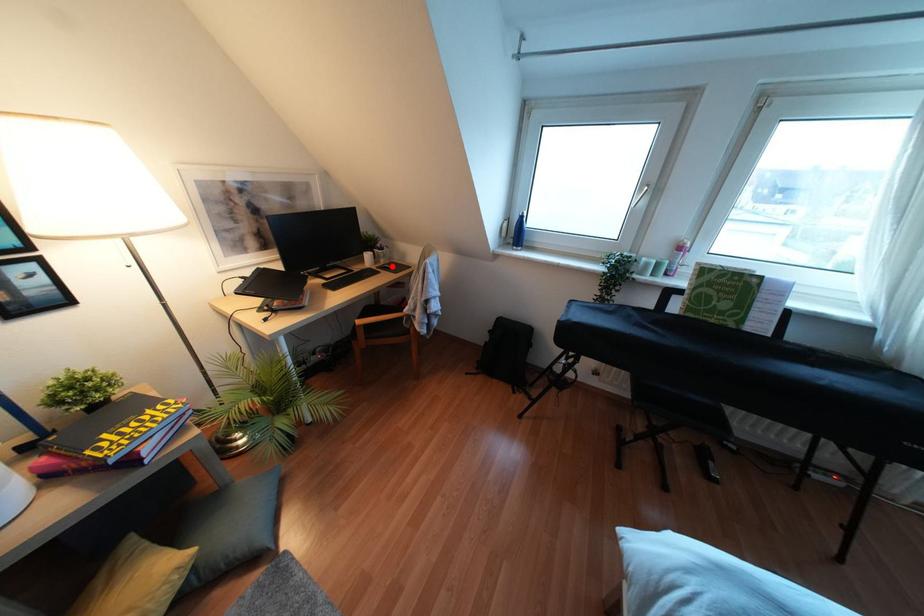
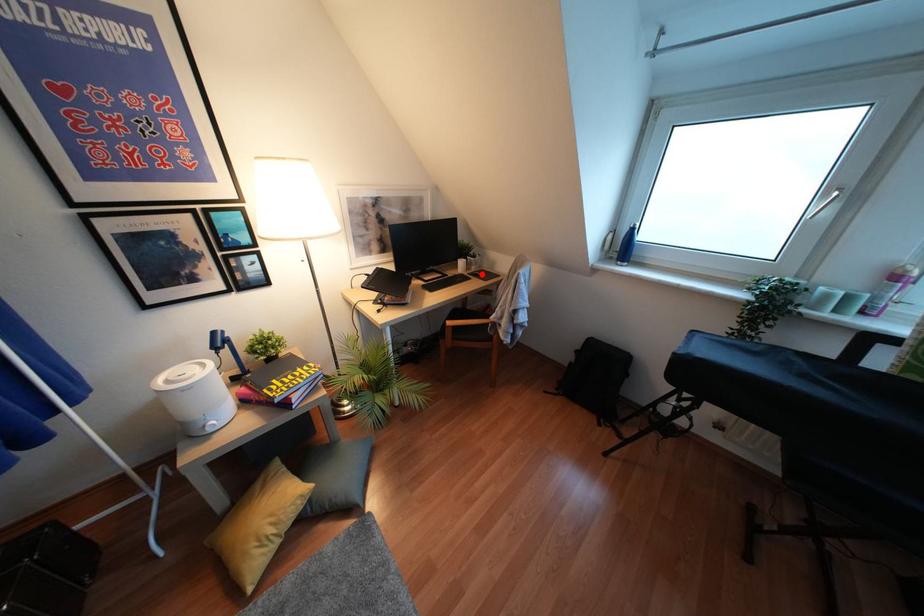
I am providing you with two images of the same scene from different viewpoints. A red point is marked on the first image and another point is marked on the second image. Is the marked point in image1 the same physical position as the marked point in image2?

Yes